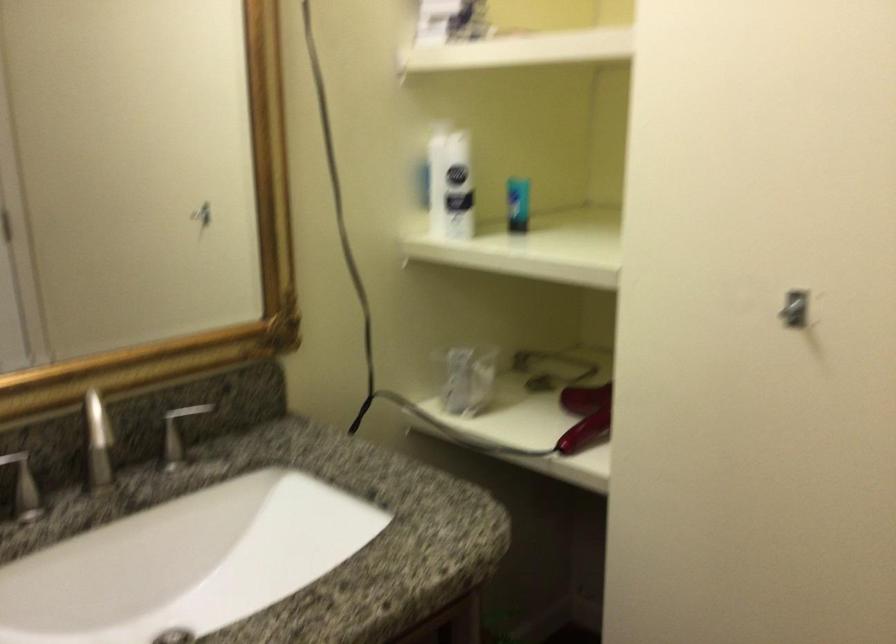
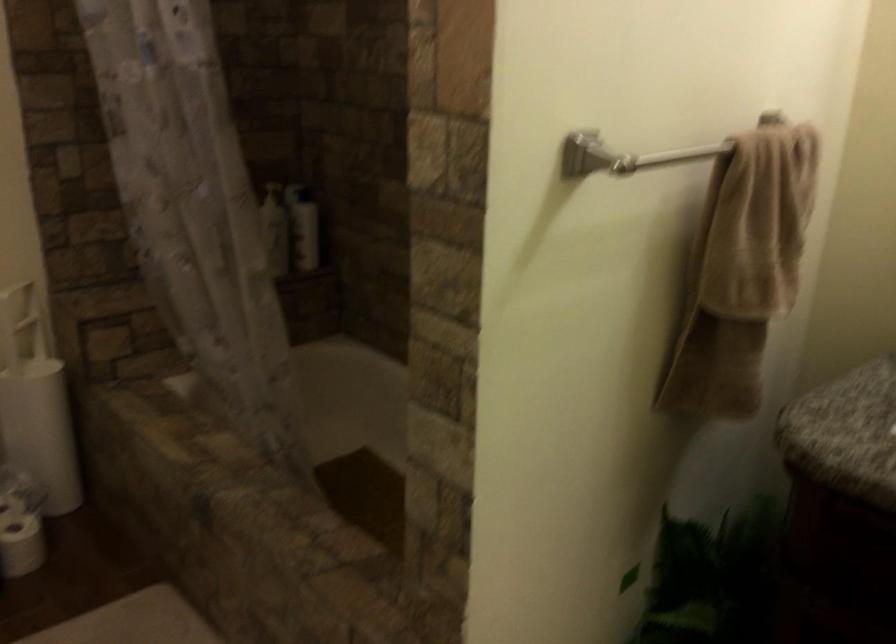
In the scene shown: First-person continuous shooting, in which direction is the camera rotating?

The camera's rotation is toward left-down.